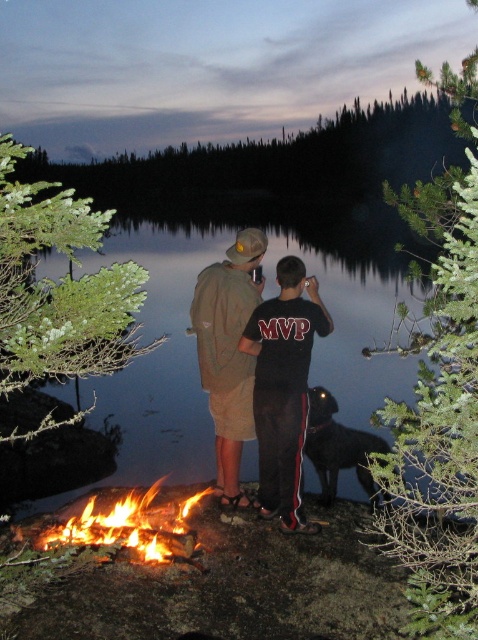
Does khaki cotton shorts at center lie behind shiny black dog at lower center?

No.

At what (x,y) coordinates should I click in order to perform the action: click on khaki cotton shorts at center. Please return your answer as a coordinate pair (x, y). The width and height of the screenshot is (478, 640). Looking at the image, I should click on (258, 364).

Between point (278, 384) and point (350, 432), which one is positioned in front?

Point (278, 384)

Where is `khaki cotton shorts at center`? The height and width of the screenshot is (640, 478). khaki cotton shorts at center is located at coordinates (258, 364).

Which is in front, point (145, 552) or point (326, 499)?

Point (145, 552)

Who is lower down, flaming wood fire at lower left or shiny black dog at lower center?

Positioned lower is flaming wood fire at lower left.

Image resolution: width=478 pixels, height=640 pixels. What are the coordinates of `flaming wood fire at lower left` in the screenshot? It's located at (131, 525).

Is glossy reflective water at center below flaming wood fire at lower left?

No.

Who is positioned more to the right, glossy reflective water at center or flaming wood fire at lower left?

glossy reflective water at center is more to the right.

What are the coordinates of `glossy reflective water at center` in the screenshot? It's located at (269, 296).